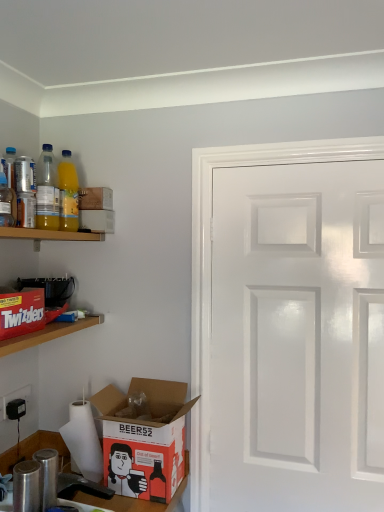
Question: Can white glossy door at right be found inside red cardboard twizzlers at left, the 1th shelf when ordered from bottom to top?

Choices:
 (A) yes
 (B) no

Answer: (B)

Question: From a real-world perspective, is red cardboard twizzlers at left, the 1th shelf when ordered from bottom to top, beneath white glossy door at right?

Choices:
 (A) yes
 (B) no

Answer: (B)

Question: Could you tell me if red cardboard twizzlers at left, the 2th shelf in the top-to-bottom sequence, is turned towards white glossy door at right?

Choices:
 (A) yes
 (B) no

Answer: (A)

Question: Considering the relative sizes of red cardboard twizzlers at left, the 1th shelf when ordered from bottom to top, and white glossy door at right in the image provided, is red cardboard twizzlers at left, the 1th shelf when ordered from bottom to top, smaller than white glossy door at right?

Choices:
 (A) yes
 (B) no

Answer: (A)

Question: Is red cardboard twizzlers at left, the 1th shelf when ordered from bottom to top, taller than white glossy door at right?

Choices:
 (A) no
 (B) yes

Answer: (A)

Question: Is white matte paper towel at lower left in front of or behind black matte coffee maker at left, which is the second appliance in bottom-to-top order, in the image?

Choices:
 (A) behind
 (B) front

Answer: (B)

Question: From the image's perspective, is white matte paper towel at lower left above or below black matte coffee maker at left, the 1th appliance viewed from the back?

Choices:
 (A) above
 (B) below

Answer: (B)

Question: From their relative heights in the image, would you say white matte paper towel at lower left is taller or shorter than black matte coffee maker at left, positioned as the second appliance in front-to-back order?

Choices:
 (A) tall
 (B) short

Answer: (A)

Question: From a real-world perspective, relative to black matte coffee maker at left, positioned as the second appliance in front-to-back order, is white matte paper towel at lower left vertically above or below?

Choices:
 (A) below
 (B) above

Answer: (A)

Question: Considering the positions of matte red cardboard box at left and black matte coffee maker at left, placed as the 1th appliance when sorted from top to bottom, in the image, is matte red cardboard box at left taller or shorter than black matte coffee maker at left, placed as the 1th appliance when sorted from top to bottom,?

Choices:
 (A) short
 (B) tall

Answer: (A)

Question: Considering the positions of matte red cardboard box at left and black matte coffee maker at left, which is the second appliance in bottom-to-top order, in the image, is matte red cardboard box at left bigger or smaller than black matte coffee maker at left, which is the second appliance in bottom-to-top order,?

Choices:
 (A) big
 (B) small

Answer: (A)

Question: Considering the positions of matte red cardboard box at left and black matte coffee maker at left, which is the second appliance in bottom-to-top order, in the image, is matte red cardboard box at left wider or thinner than black matte coffee maker at left, which is the second appliance in bottom-to-top order,?

Choices:
 (A) thin
 (B) wide

Answer: (A)

Question: From the image's perspective, is matte red cardboard box at left above or below black matte coffee maker at left, placed as the 1th appliance when sorted from top to bottom?

Choices:
 (A) below
 (B) above

Answer: (A)

Question: Is matte cardboard box at upper left, which ranks as the 3th box in bottom-to-top order, in front of or behind matte cardboard box at upper left, the second box from the top, in the image?

Choices:
 (A) front
 (B) behind

Answer: (A)

Question: In terms of width, does matte cardboard box at upper left, which is counted as the 1th box, starting from the top, look wider or thinner when compared to matte cardboard box at upper left, the second box from the top?

Choices:
 (A) thin
 (B) wide

Answer: (A)